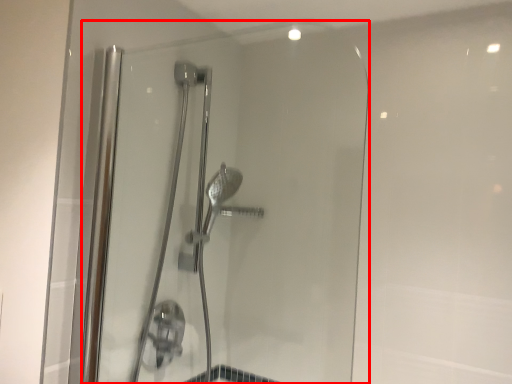
Question: From the image, what is the correct spatial relationship of shower door (annotated by the red box) in relation to shower door?

Choices:
 (A) left
 (B) right

Answer: (B)